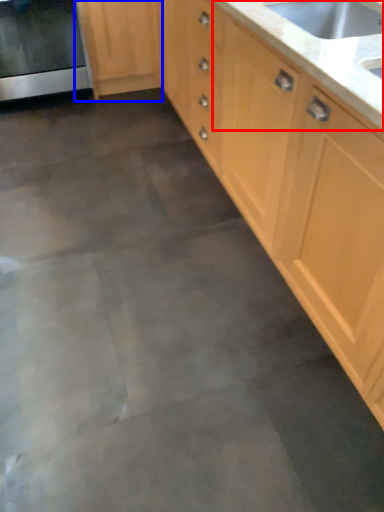
Question: Which object is closer to the camera taking this photo, countertop (highlighted by a red box) or cabinetry (highlighted by a blue box)?

Choices:
 (A) countertop
 (B) cabinetry

Answer: (A)